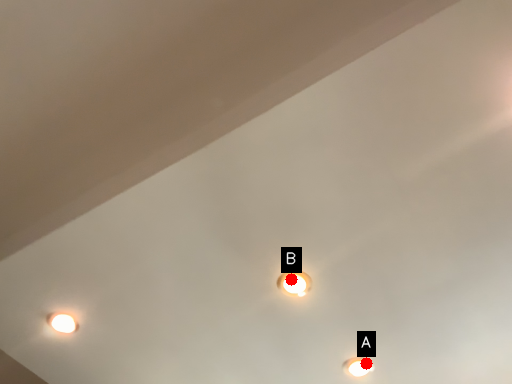
Question: Two points are circled on the image, labeled by A and B beside each circle. Which point is further to the camera?

Choices:
 (A) A is further
 (B) B is further

Answer: (A)